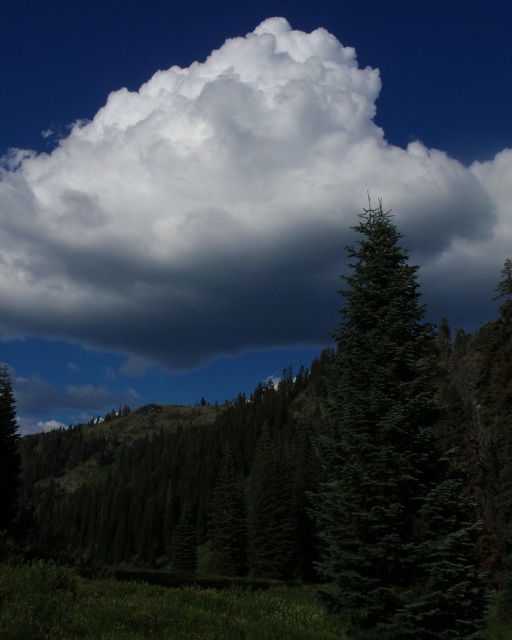
You are standing in the forest looking up at the sky. Which object, the white fluffy cloud at upper center or the green matte tree at center, is closer to your eyes?

The white fluffy cloud at upper center is closer to your eyes because it is further to the viewer than the green matte tree at center.

You are an airplane passenger looking out the window and see the white fluffy cloud at upper center and the green matte tree at left. Which object appears wider from your view?

The white fluffy cloud at upper center appears wider than the green matte tree at left because its width surpasses the tree.

You are a bird soaring in the sky. You want to land on the white fluffy cloud at upper center. However, you notice a point at coordinates (234, 208). Is this point part of the cloud?

The point at (234, 208) is where the white fluffy cloud at upper center is located, so yes, this point is part of the cloud.